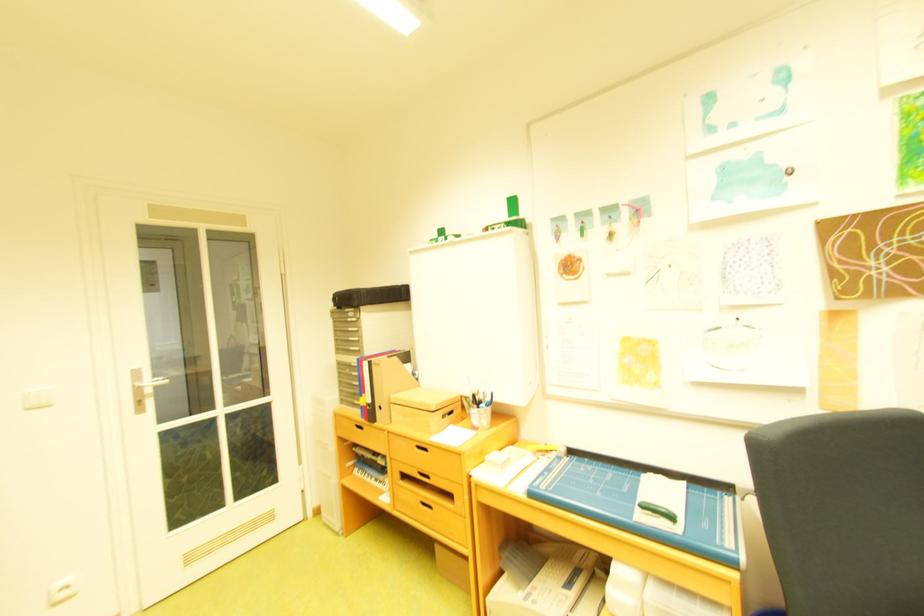
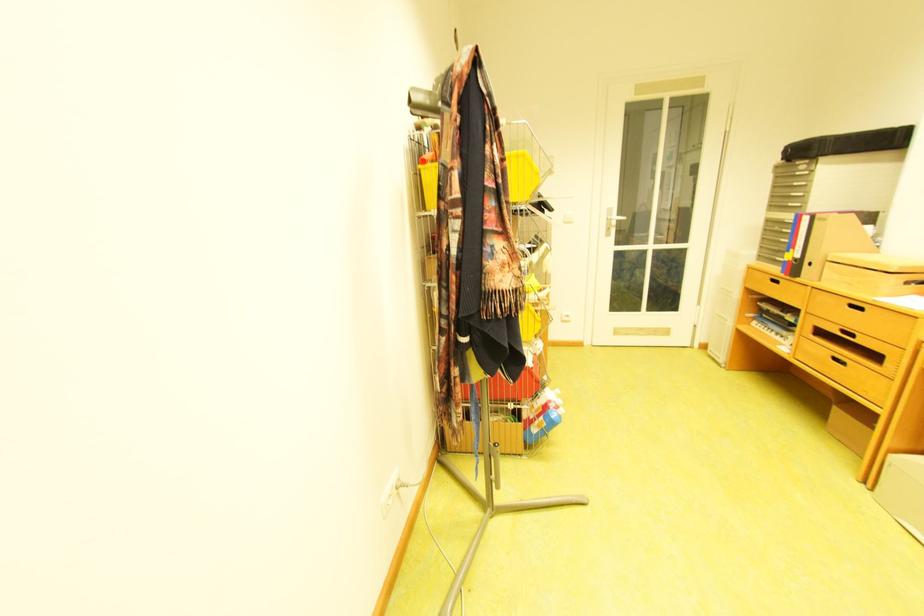
Locate, in the second image, the point that corresponds to pixel 357 312 in the first image.

(808, 164)